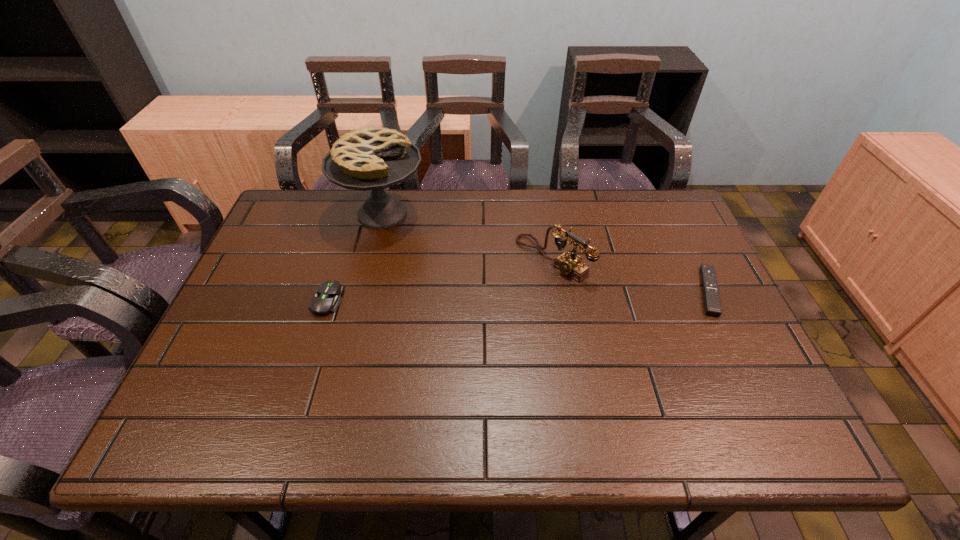
This screenshot has height=540, width=960. What are the coordinates of `vacant area at the right edge` in the screenshot? It's located at (678, 238).

Identify the location of free spot at the far left corner of the desktop. (313, 203).

This screenshot has height=540, width=960. In order to click on free point at the far right corner in this screenshot , I will do `click(665, 199)`.

This screenshot has width=960, height=540. What are the coordinates of `free space that is in between the second shortest object and the tallest object` in the screenshot? It's located at (355, 257).

Locate an element on the screen. free space between the second object from right to left and the computer mouse is located at coordinates (440, 279).

Where is `vacant space that's between the rightmost object and the pie`? The image size is (960, 540). vacant space that's between the rightmost object and the pie is located at coordinates (545, 252).

Locate an element on the screen. The height and width of the screenshot is (540, 960). vacant space in between the pie and the computer mouse is located at coordinates (355, 257).

Where is `free spot between the third shortest object and the rightmost object`? The height and width of the screenshot is (540, 960). free spot between the third shortest object and the rightmost object is located at coordinates (631, 275).

Locate an element on the screen. The image size is (960, 540). empty space between the tallest object and the rightmost object is located at coordinates (545, 252).

This screenshot has height=540, width=960. What are the coordinates of `vacant area that lies between the tallest object and the rightmost object` in the screenshot? It's located at (545, 252).